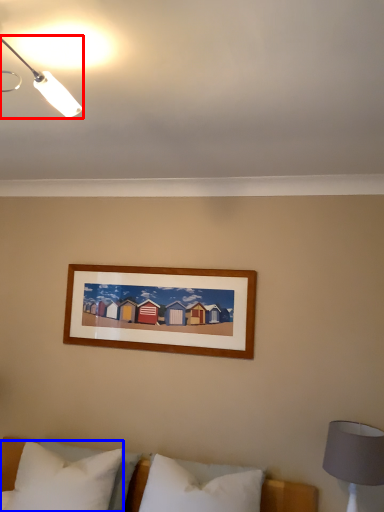
Question: Which object appears closest to the camera in this image, lamp (highlighted by a red box) or pillow (highlighted by a blue box)?

Choices:
 (A) lamp
 (B) pillow

Answer: (A)